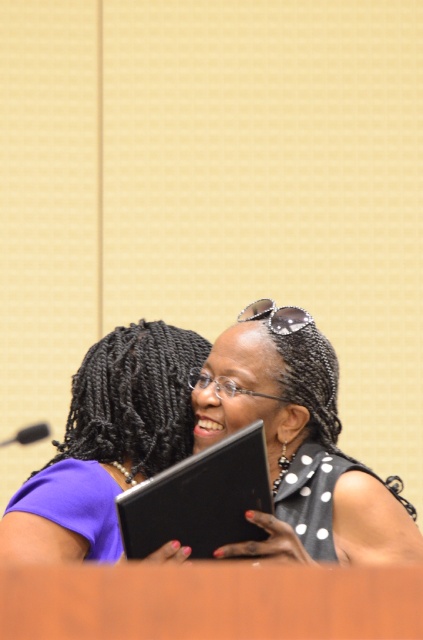
Question: Among these objects, which one is nearest to the camera?

Choices:
 (A) black dotted dress at center
 (B) purple matte dress at center

Answer: (A)

Question: Which object appears farthest from the camera in this image?

Choices:
 (A) purple matte dress at center
 (B) black dotted dress at center

Answer: (A)

Question: Can you confirm if black dotted dress at center is positioned above purple matte dress at center?

Choices:
 (A) no
 (B) yes

Answer: (B)

Question: Is the position of black dotted dress at center less distant than that of purple matte dress at center?

Choices:
 (A) yes
 (B) no

Answer: (A)

Question: Is black dotted dress at center smaller than purple matte dress at center?

Choices:
 (A) yes
 (B) no

Answer: (A)